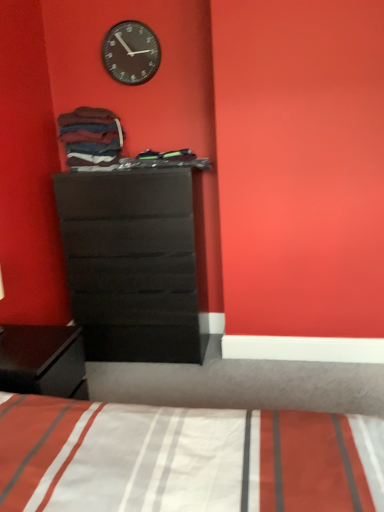
What are the coordinates of `space that is in front of matte black dresser at center` in the screenshot? It's located at (152, 381).